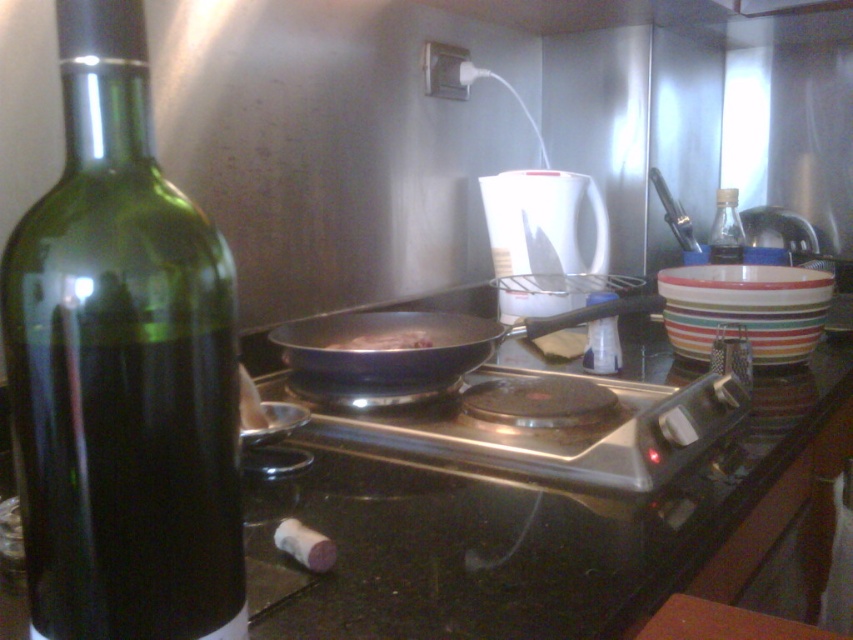
You are standing in the kitchen and want to place a small object on the surface between the two points, point (393, 428) and point (345, 346). Which point is closer to you so you can place it there first?

Point (393, 428) is closer to the viewer than point (345, 346), so you should place the object there first.

You are a kitchen assistant who needs to reach the transparent glass bottle at upper right to grab a spice. Is the green glass bottle at left blocking your path to it?

The green glass bottle at left is in front of the transparent glass bottle at upper right, so it is blocking the path to the transparent glass bottle at upper right.

You are a chef preparing a dish and need to reach both the shiny black frying pan at center and the transparent glass bottle at upper right. Which object will you need to stretch your arm further to reach?

The transparent glass bottle at upper right requires stretching further because it is farther away from the viewer compared to the shiny black frying pan at center.